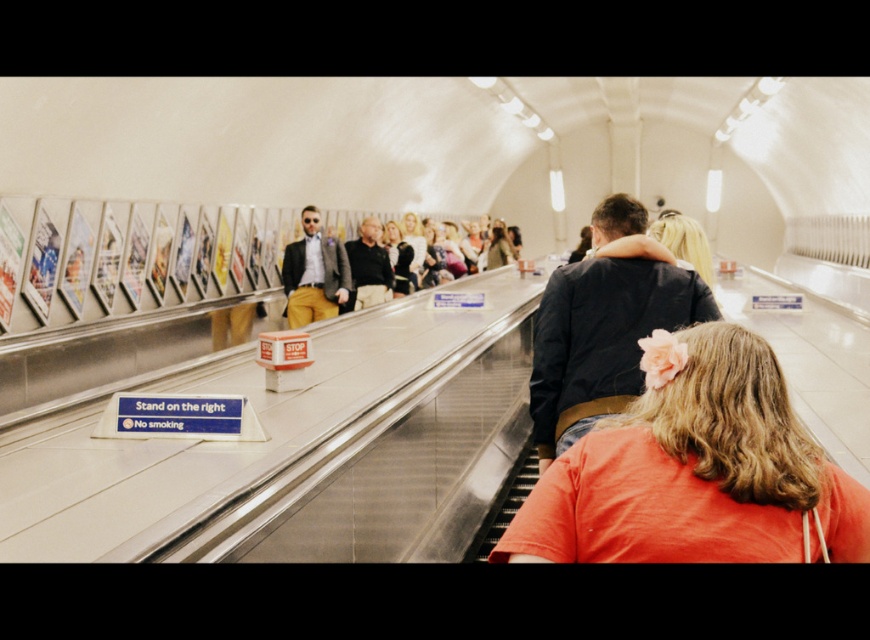
Question: Considering the real-world distances, which object is closest to the dark blue jacket at center?

Choices:
 (A) orange cotton shirt at center
 (B) matte black jacket at center

Answer: (A)

Question: Estimate the real-world distances between objects in this image. Which object is farther from the dark blue jacket at center?

Choices:
 (A) orange cotton shirt at center
 (B) matte black jacket at center
 (C) blonde hair at upper center

Answer: (B)

Question: Is blonde hair at upper center above matte black jacket at center?

Choices:
 (A) yes
 (B) no

Answer: (B)

Question: Can you confirm if dark blue jacket at center is smaller than matte black jacket at center?

Choices:
 (A) yes
 (B) no

Answer: (A)

Question: Which point is closer to the camera taking this photo?

Choices:
 (A) (743, 515)
 (B) (574, 333)

Answer: (A)

Question: Does blonde hair at upper center appear over matte black jacket at center?

Choices:
 (A) no
 (B) yes

Answer: (A)